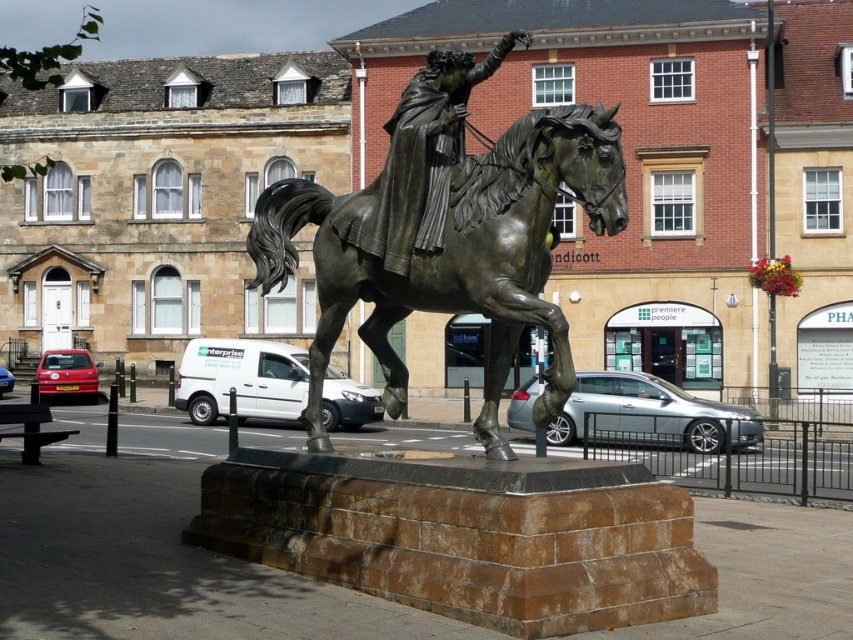
You are standing in front of the bronze equestrian statue in the town square. You notice two points marked on the statue base. One is at point coordinates point (495, 360) and the other at point (521, 38). Which point is nearer to you?

Point (495, 360) is closer to the viewer than point (521, 38).